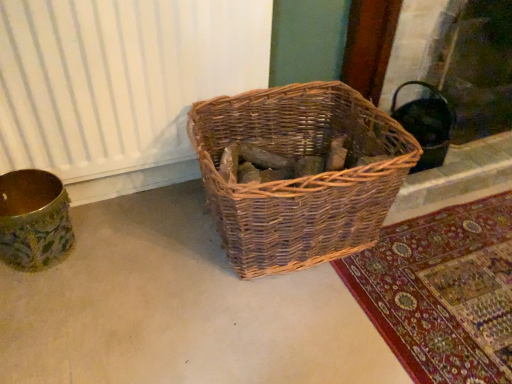
The height and width of the screenshot is (384, 512). What are the coordinates of `vacant space to the left of natural woven basket at center` in the screenshot? It's located at (124, 269).